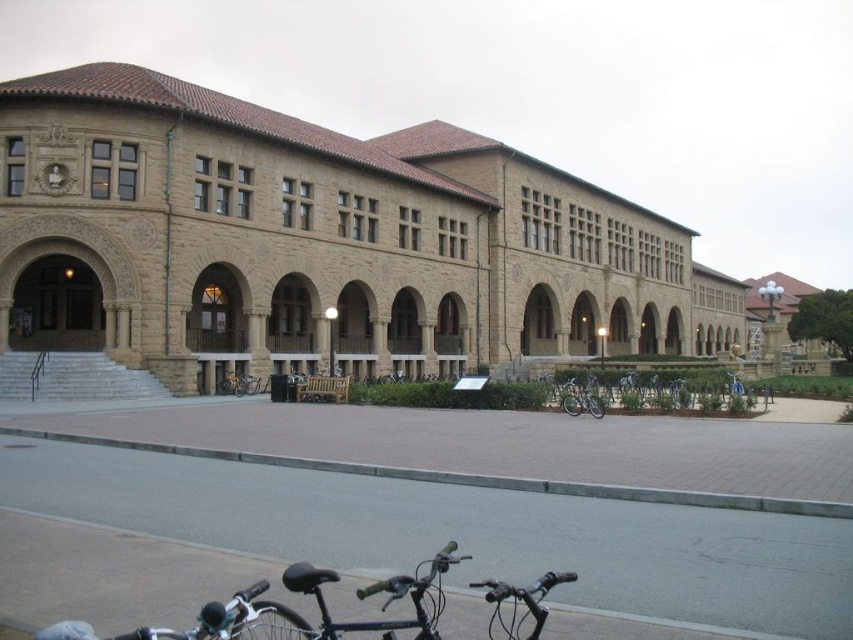
Who is shorter, shiny metallic bicycle at center or blue metallic bicycle at center?

With less height is blue metallic bicycle at center.

Is shiny metallic bicycle at center in front of blue metallic bicycle at center?

No, shiny metallic bicycle at center is further to the viewer.

What are the coordinates of `shiny metallic bicycle at center` in the screenshot? It's located at (235, 384).

Who is lower down, gray concrete curb at lower center or blue metallic bicycle at center?

gray concrete curb at lower center

Is point (442, 483) behind point (737, 371)?

No, it is not.

What do you see at coordinates (471, 477) in the screenshot?
I see `gray concrete curb at lower center` at bounding box center [471, 477].

Find the location of a particular element. Image resolution: width=853 pixels, height=640 pixels. gray concrete curb at lower center is located at coordinates (471, 477).

From the picture: Who is positioned more to the left, shiny metallic bicycle at center-right or shiny metallic bicycle at center?

shiny metallic bicycle at center

Is shiny metallic bicycle at center-right wider than shiny metallic bicycle at center?

Correct, the width of shiny metallic bicycle at center-right exceeds that of shiny metallic bicycle at center.

Does point (572, 412) come farther from viewer compared to point (242, 394)?

No, it is in front of (242, 394).

Where is `shiny metallic bicycle at center-right`? The width and height of the screenshot is (853, 640). shiny metallic bicycle at center-right is located at coordinates (581, 400).